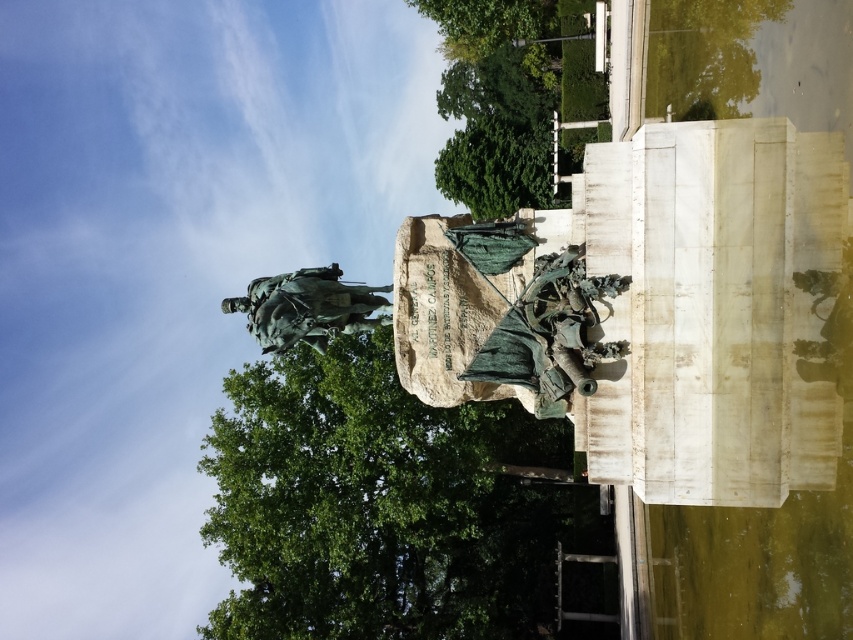
You are standing in front of the bronze statue at center and want to take a photo of the green leafy tree at upper center. In which direction should you move to ensure the tree is in your camera frame?

You should move to your left because the green leafy tree at upper center is to the right of the bronze statue at center, so moving left will bring the tree into view.

You are standing at the origin point in the park. The statue is located at point 0.0,0.0. Where is the green leafy tree at center relative to the statue?

The green leafy tree at center is located at point (376, 504) relative to the statue at (0, 0).

You are standing at the base of the statue and want to take a photo of the green leafy tree at center. Which direction should you face to capture it in your camera?

The green leafy tree at center is located at coordinates (376, 504), which is to the right and slightly above the center of the scene. Therefore, you should face towards the right side of the statue to capture the green leafy tree at center in your photo.